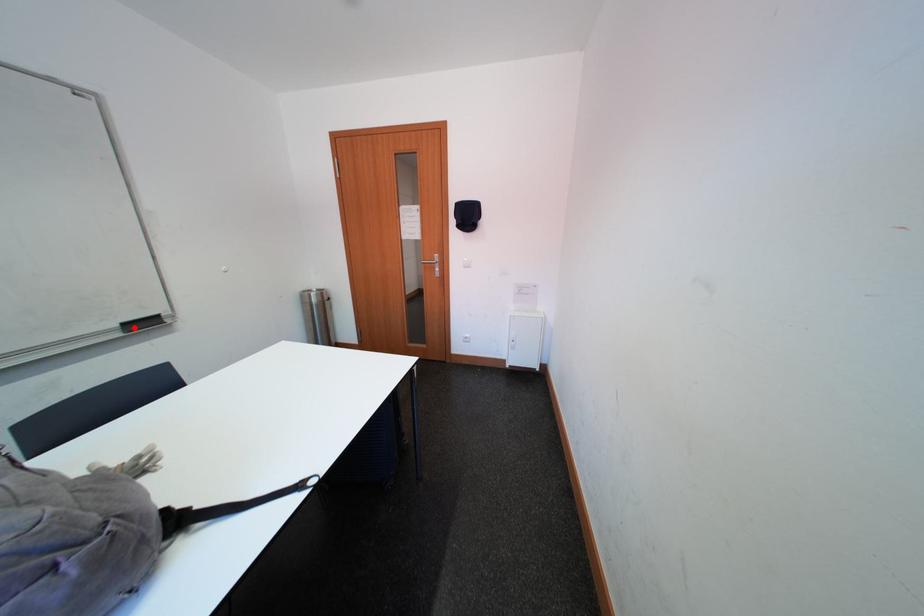
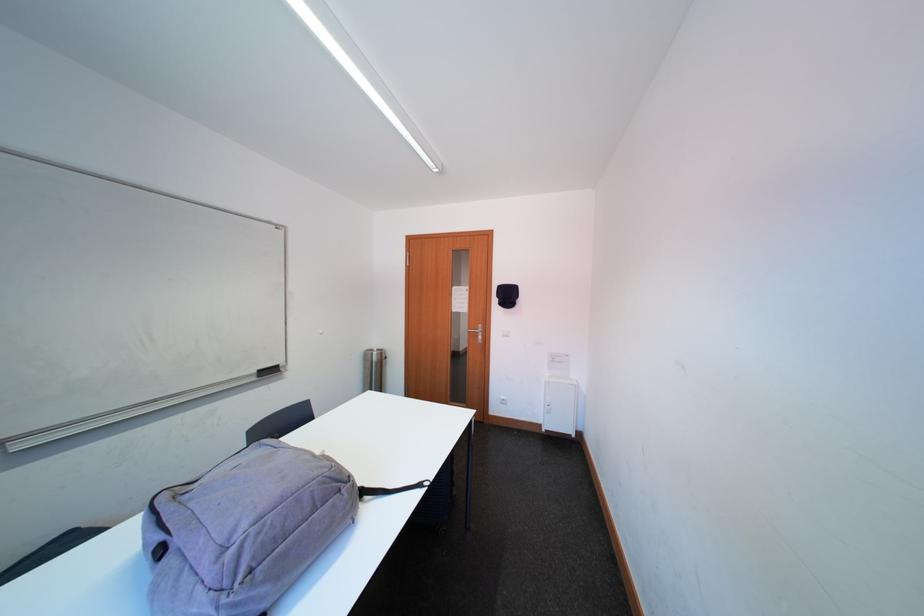
Where in the second image is the point corresponding to the highlighted location from the first image?

(269, 375)